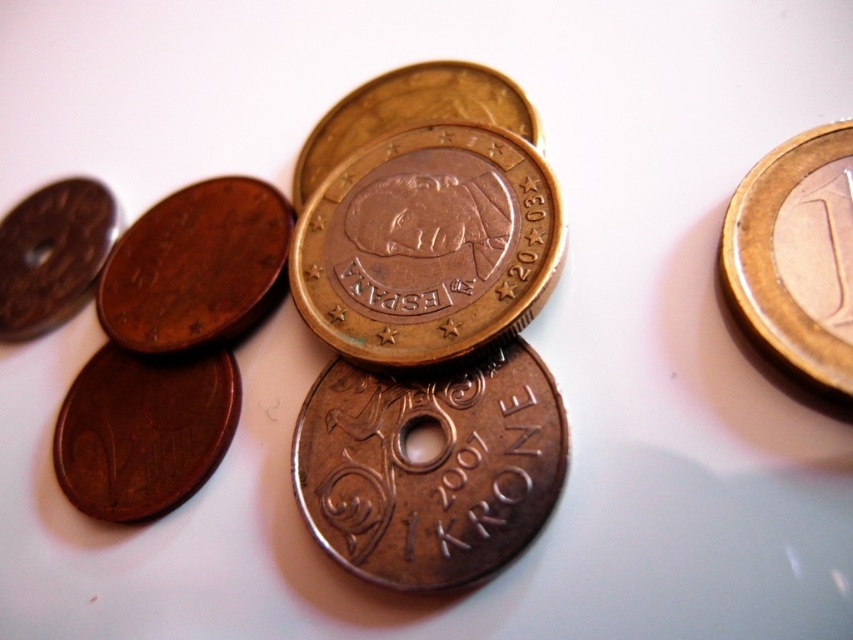
Does brass/bronze coin at lower left have a larger size compared to bronze metallic coin at center?

No.

Does point (178, 474) come behind point (450, 92)?

No, it is not.

This screenshot has height=640, width=853. Describe the element at coordinates (143, 429) in the screenshot. I see `brass/bronze coin at lower left` at that location.

This screenshot has height=640, width=853. In order to click on brass/bronze coin at lower left in this screenshot , I will do point(143,429).

Based on the photo, which is above, bronze/copper coin at center or bronze metallic coin at center?

bronze metallic coin at center is higher up.

Does point (521, 509) come in front of point (405, 77)?

Yes, point (521, 509) is in front of point (405, 77).

Who is more forward, (x=401, y=497) or (x=369, y=124)?

Positioned in front is point (x=401, y=497).

Where is `bronze/copper coin at center`? bronze/copper coin at center is located at coordinates (430, 468).

In the scene shown: Between gold metallic coin at upper right and brass/bronze coin at lower left, which one appears on the right side from the viewer's perspective?

gold metallic coin at upper right

What do you see at coordinates (796, 253) in the screenshot? The image size is (853, 640). I see `gold metallic coin at upper right` at bounding box center [796, 253].

What do you see at coordinates (796, 253) in the screenshot? I see `gold metallic coin at upper right` at bounding box center [796, 253].

This screenshot has width=853, height=640. Identify the location of gold metallic coin at upper right. (796, 253).